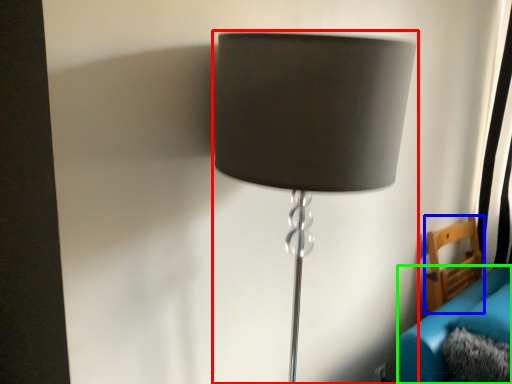
Question: Which object is positioned farthest from lamp (highlighted by a red box)? Select from furniture (highlighted by a blue box) and couch (highlighted by a green box).

Choices:
 (A) furniture
 (B) couch

Answer: (A)